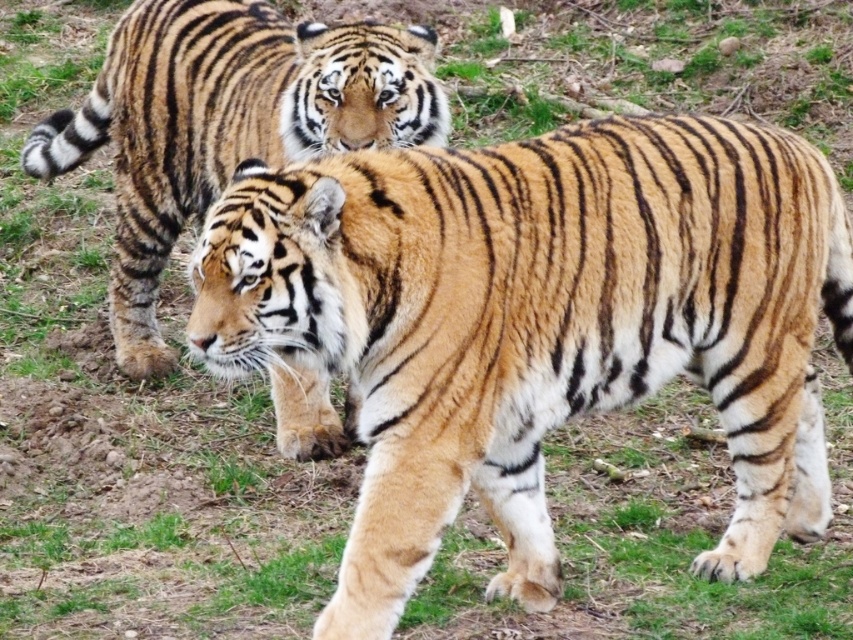
This screenshot has height=640, width=853. Describe the element at coordinates (538, 323) in the screenshot. I see `golden fur tiger at center` at that location.

Consider the image. Who is taller, golden fur tiger at center or orange-brown fur tiger at center?

orange-brown fur tiger at center

Is point (780, 134) in front of point (270, 104)?

Yes, it is.

Where is `golden fur tiger at center`? The width and height of the screenshot is (853, 640). golden fur tiger at center is located at coordinates (538, 323).